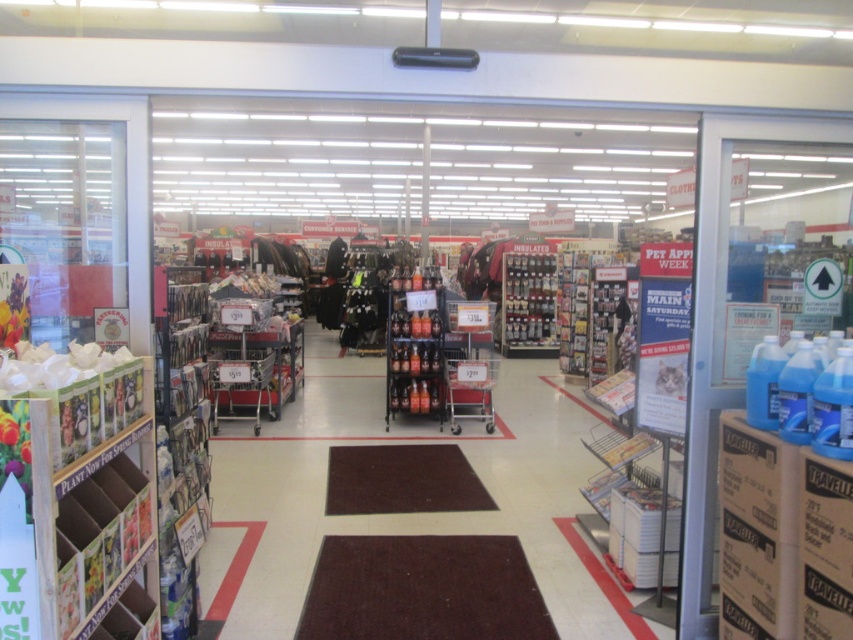
You are a customer in the store and want to grab both the metallic silver bottles at center and the metallic silver chocolates at center. Which item should you reach for first if you want to pick up the one closer to you?

The metallic silver bottles at center is in front of the metallic silver chocolates at center, so you should reach for the metallic silver bottles at center first as it is closer to you.